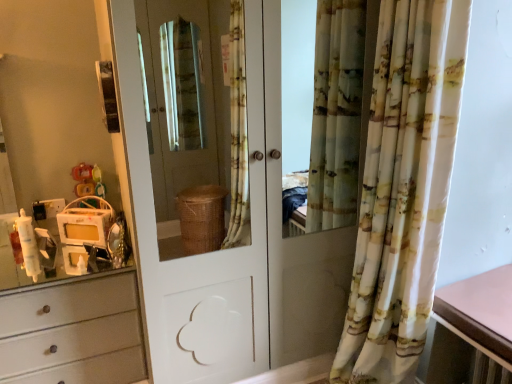
Question: Is white glossy door at center thinner than printed fabric curtain at right?

Choices:
 (A) no
 (B) yes

Answer: (A)

Question: Can you confirm if white glossy door at center is smaller than printed fabric curtain at right?

Choices:
 (A) yes
 (B) no

Answer: (B)

Question: Is printed fabric curtain at right a part of white glossy door at center?

Choices:
 (A) yes
 (B) no

Answer: (B)

Question: From the image's perspective, is white glossy door at center located above printed fabric curtain at right?

Choices:
 (A) no
 (B) yes

Answer: (B)

Question: Is white glossy door at center taller than printed fabric curtain at right?

Choices:
 (A) yes
 (B) no

Answer: (A)

Question: From their relative heights in the image, would you say printed fabric curtain at right is taller or shorter than white glossy door at center?

Choices:
 (A) short
 (B) tall

Answer: (A)

Question: Considering the positions of printed fabric curtain at right and white glossy door at center in the image, is printed fabric curtain at right wider or thinner than white glossy door at center?

Choices:
 (A) thin
 (B) wide

Answer: (A)

Question: In terms of size, does printed fabric curtain at right appear bigger or smaller than white glossy door at center?

Choices:
 (A) big
 (B) small

Answer: (B)

Question: From the image's perspective, relative to white glossy door at center, is printed fabric curtain at right above or below?

Choices:
 (A) above
 (B) below

Answer: (B)

Question: Is white glossy door at center situated inside printed fabric curtain at right or outside?

Choices:
 (A) outside
 (B) inside

Answer: (A)

Question: In the image, is white glossy door at center positioned in front of or behind printed fabric curtain at right?

Choices:
 (A) front
 (B) behind

Answer: (B)

Question: Is point (151, 160) closer or farther from the camera than point (392, 281)?

Choices:
 (A) closer
 (B) farther

Answer: (B)

Question: Based on their sizes in the image, would you say white glossy door at center is bigger or smaller than printed fabric curtain at right?

Choices:
 (A) small
 (B) big

Answer: (B)

Question: In terms of size, does printed fabric curtain at right appear bigger or smaller than plastic yellow toy at left?

Choices:
 (A) small
 (B) big

Answer: (B)

Question: Looking at their shapes, would you say printed fabric curtain at right is wider or thinner than plastic yellow toy at left?

Choices:
 (A) thin
 (B) wide

Answer: (B)